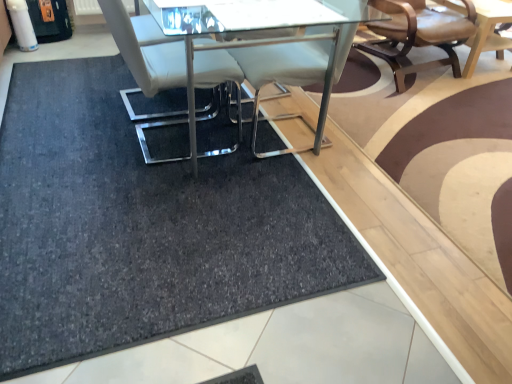
The height and width of the screenshot is (384, 512). I want to click on clear glass table at center, the 2th table positioned from the back, so click(304, 63).

What is the approximate width of light brown wooden table at upper right, the 1th table positioned from the right?

light brown wooden table at upper right, the 1th table positioned from the right, is 35.78 inches wide.

How much space does leather seat at upper right, placed as the 2th chair when sorted from left to right, occupy horizontally?

33.86 inches.

Where is `clear glass table at center, marked as the 1th table in a left-to-right arrangement`? clear glass table at center, marked as the 1th table in a left-to-right arrangement is located at coordinates coord(304,63).

Based on the photo, considering the relative sizes of dark gray carpet at center and leather seat at upper right, placed as the 2th chair when sorted from left to right, in the image provided, is dark gray carpet at center bigger than leather seat at upper right, placed as the 2th chair when sorted from left to right,?

No.

From the image's perspective, is dark gray carpet at center on leather seat at upper right, which appears as the first chair when viewed from the back?

Incorrect, from the image's perspective, dark gray carpet at center is lower than leather seat at upper right, which appears as the first chair when viewed from the back.

Can you confirm if dark gray carpet at center is shorter than leather seat at upper right, the second chair viewed from the front?

Indeed, dark gray carpet at center has a lesser height compared to leather seat at upper right, the second chair viewed from the front.

Looking at this image, is leather seat at upper right, the second chair viewed from the front, placed right next to light brown wooden table at upper right, the 2th table from the left?

No, leather seat at upper right, the second chair viewed from the front, is not making contact with light brown wooden table at upper right, the 2th table from the left.

Looking at this image, visually, is leather seat at upper right, placed as the 2th chair when sorted from left to right, positioned to the left or to the right of light brown wooden table at upper right, which is counted as the 1th table, starting from the back?

In the image, leather seat at upper right, placed as the 2th chair when sorted from left to right, appears on the left side of light brown wooden table at upper right, which is counted as the 1th table, starting from the back.

Does point (391, 35) come in front of point (510, 11)?

Yes, it is.

Considering the relative sizes of light brown wooden table at upper right, which is counted as the 1th table, starting from the back, and clear glass table at center, marked as the 1th table in a left-to-right arrangement, in the image provided, is light brown wooden table at upper right, which is counted as the 1th table, starting from the back, smaller than clear glass table at center, marked as the 1th table in a left-to-right arrangement,?

Correct, light brown wooden table at upper right, which is counted as the 1th table, starting from the back, occupies less space than clear glass table at center, marked as the 1th table in a left-to-right arrangement.

Is the depth of light brown wooden table at upper right, the 1th table positioned from the right, greater than that of clear glass table at center, marked as the 1th table in a left-to-right arrangement?

Yes.

From a real-world perspective, which object rests below the other?

light brown wooden table at upper right, the 2th table from the left.

Is light brown wooden table at upper right, the 2th table from the left, not close to clear glass table at center, marked as the 1th table in a left-to-right arrangement?

No.

Where is `table above the leather seat at upper right, placed as the first chair when sorted from right to left (from the image's perspective)`? The image size is (512, 384). table above the leather seat at upper right, placed as the first chair when sorted from right to left (from the image's perspective) is located at coordinates (488, 32).

Considering the positions of point (505, 6) and point (385, 50), is point (505, 6) closer or farther from the camera than point (385, 50)?

Point (505, 6) is positioned closer to the camera compared to point (385, 50).

Which object is more forward, light brown wooden table at upper right, the 1th table positioned from the right, or leather seat at upper right, placed as the 2th chair when sorted from left to right?

leather seat at upper right, placed as the 2th chair when sorted from left to right, is closer to the camera.

How much distance is there between light brown wooden table at upper right, the second table when ordered from front to back, and leather seat at upper right, the second chair viewed from the front?

They are 10.11 inches apart.

Image resolution: width=512 pixels, height=384 pixels. What are the coordinates of `doormat below the light brown wooden table at upper right, which is counted as the 1th table, starting from the back (from the image's perspective)` in the screenshot? It's located at (142, 227).

Is dark gray carpet at center with light brown wooden table at upper right, the 2th table from the left?

No, dark gray carpet at center is not beside light brown wooden table at upper right, the 2th table from the left.

Considering the sizes of dark gray carpet at center and light brown wooden table at upper right, which is counted as the 1th table, starting from the back, in the image, is dark gray carpet at center bigger or smaller than light brown wooden table at upper right, which is counted as the 1th table, starting from the back,?

Clearly, dark gray carpet at center is smaller in size than light brown wooden table at upper right, which is counted as the 1th table, starting from the back.

Is dark gray carpet at center facing towards light brown wooden table at upper right, the 2th table from the left?

No, dark gray carpet at center does not turn towards light brown wooden table at upper right, the 2th table from the left.

Who is more distant, dark gray carpet at center or white leather chair at center, which is counted as the 2th chair, starting from the right?

white leather chair at center, which is counted as the 2th chair, starting from the right.

Where is `doormat lying below the white leather chair at center, the first chair when ordered from front to back (from the image's perspective)`? The height and width of the screenshot is (384, 512). doormat lying below the white leather chair at center, the first chair when ordered from front to back (from the image's perspective) is located at coordinates (142, 227).

Does point (371, 274) come behind point (145, 65)?

No, it is in front of (145, 65).

Is dark gray carpet at center wider than white leather chair at center, the second chair in the back-to-front sequence?

Yes.

In the image, is white leather chair at center, which is counted as the 2th chair, starting from the right, positioned in front of or behind dark gray carpet at center?

In the image, white leather chair at center, which is counted as the 2th chair, starting from the right, appears behind dark gray carpet at center.

Identify the location of the 2nd chair above when counting from the dark gray carpet at center (from the image's perspective). This screenshot has height=384, width=512. (417, 35).

Where is `table that is behind the leather seat at upper right, placed as the first chair when sorted from right to left`? table that is behind the leather seat at upper right, placed as the first chair when sorted from right to left is located at coordinates (488, 32).

Considering their positions, is white leather chair at center, which is the first chair from left to right, positioned further to leather seat at upper right, which appears as the first chair when viewed from the back, than light brown wooden table at upper right, the 2th table from the left?

white leather chair at center, which is the first chair from left to right.

Which object lies nearer to the anchor point leather seat at upper right, the second chair viewed from the front, light brown wooden table at upper right, the 1th table positioned from the right, or dark gray carpet at center?

The object closer to leather seat at upper right, the second chair viewed from the front, is light brown wooden table at upper right, the 1th table positioned from the right.

Looking at this image, considering their positions, is leather seat at upper right, placed as the 2th chair when sorted from left to right, positioned further to white leather chair at center, which is counted as the 2th chair, starting from the right, than light brown wooden table at upper right, which is counted as the 1th table, starting from the back?

Among the two, light brown wooden table at upper right, which is counted as the 1th table, starting from the back, is located further to white leather chair at center, which is counted as the 2th chair, starting from the right.

Which object lies nearer to the anchor point white leather chair at center, the first chair when ordered from front to back, leather seat at upper right, which appears as the first chair when viewed from the back, or dark gray carpet at center?

dark gray carpet at center.

Based on their spatial positions, is white leather chair at center, the first chair when ordered from front to back, or light brown wooden table at upper right, the second table when ordered from front to back, further from dark gray carpet at center?

light brown wooden table at upper right, the second table when ordered from front to back.

Considering their positions, is clear glass table at center, which ranks as the first table in front-to-back order, positioned further to dark gray carpet at center than leather seat at upper right, placed as the first chair when sorted from right to left?

Among the two, leather seat at upper right, placed as the first chair when sorted from right to left, is located further to dark gray carpet at center.

Estimate the real-world distances between objects in this image. Which object is further from light brown wooden table at upper right, the 1th table positioned from the right, dark gray carpet at center or white leather chair at center, which is the first chair from left to right?

The object further to light brown wooden table at upper right, the 1th table positioned from the right, is dark gray carpet at center.

Based on their spatial positions, is leather seat at upper right, placed as the 2th chair when sorted from left to right, or clear glass table at center, placed as the second table when sorted from right to left, further from dark gray carpet at center?

leather seat at upper right, placed as the 2th chair when sorted from left to right.

I want to click on chair between clear glass table at center, marked as the 1th table in a left-to-right arrangement, and dark gray carpet at center in the up-down direction, so click(146, 49).

Locate an element on the screen. The width and height of the screenshot is (512, 384). chair between white leather chair at center, which is counted as the 2th chair, starting from the right, and light brown wooden table at upper right, the second table when ordered from front to back is located at coordinates (417, 35).

Identify the location of chair between dark gray carpet at center and leather seat at upper right, which appears as the first chair when viewed from the back. (146, 49).

The width and height of the screenshot is (512, 384). I want to click on table between white leather chair at center, which is the first chair from left to right, and leather seat at upper right, the second chair viewed from the front, in the horizontal direction, so click(x=304, y=63).